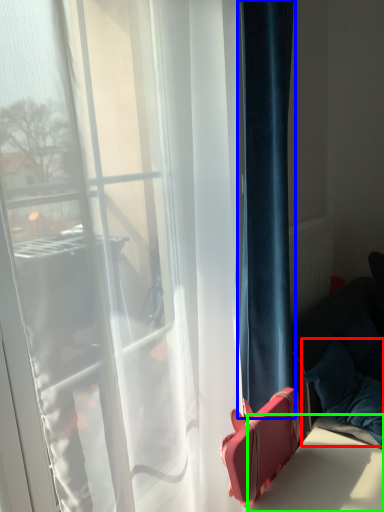
Question: Which is nearer to the pillow (highlighted by a red box)? curtain (highlighted by a blue box) or table (highlighted by a green box).

Choices:
 (A) curtain
 (B) table

Answer: (B)